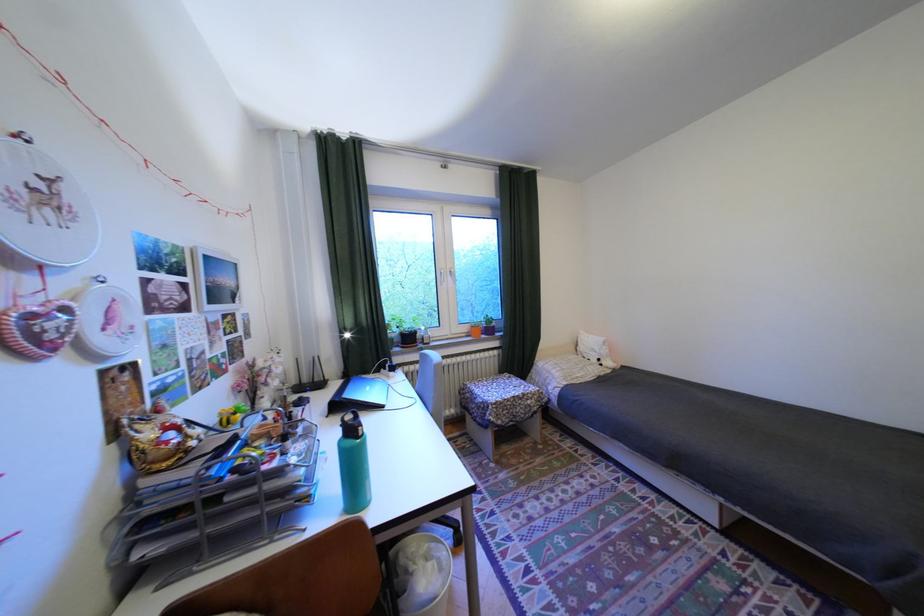
Where is `white window handle`? This screenshot has height=616, width=924. white window handle is located at coordinates (447, 277).